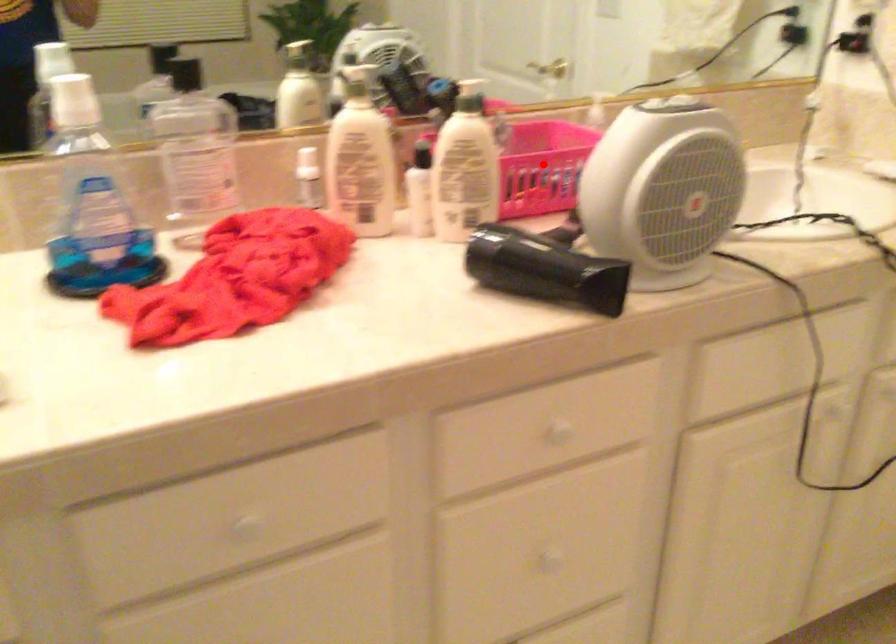
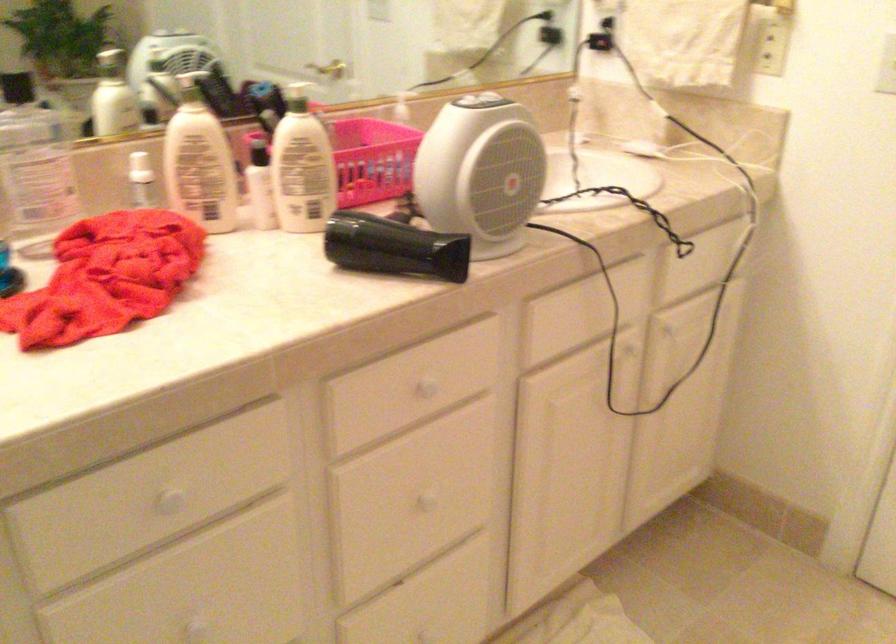
Question: I am providing you with two images of the same scene from different viewpoints. A red point is shown in image1. For the corresponding object point in image2, is it positioned nearer or farther from the camera?

Choices:
 (A) Nearer
 (B) Farther

Answer: (B)